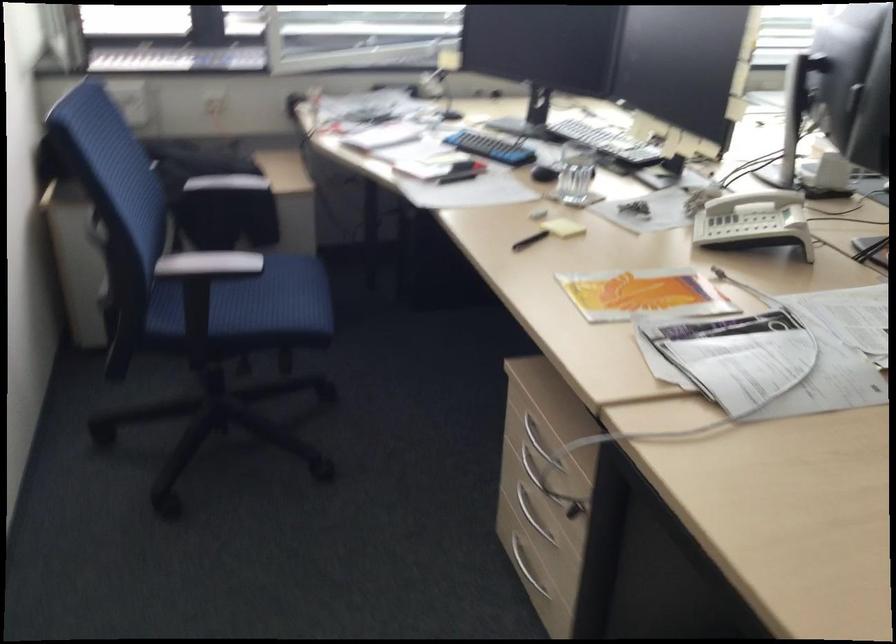
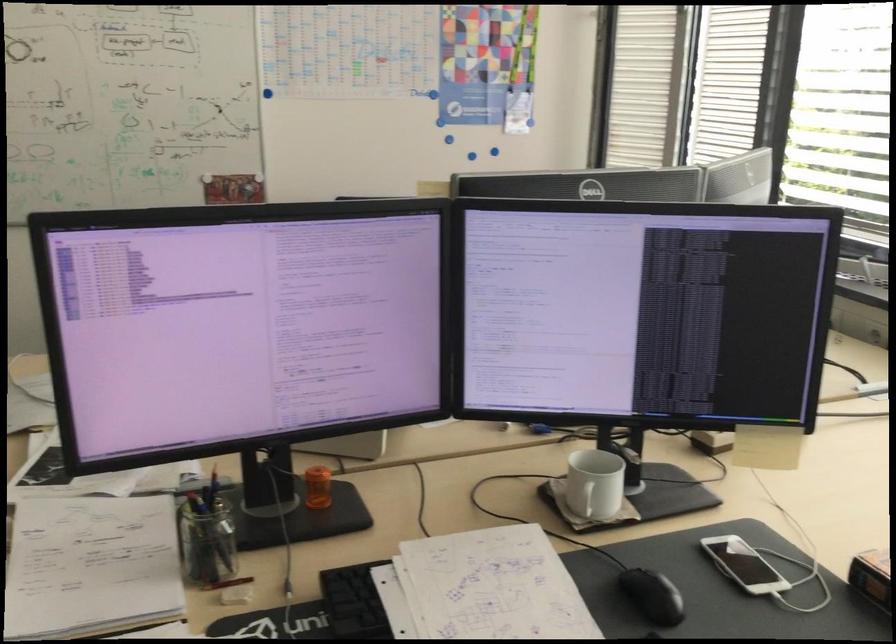
Question: I am providing you with two images of the same scene from different viewpoints. After the viewpoint changes to image2, which objects are now occluded?

Choices:
 (A) white mug handle
 (B) telephone button
 (C) glass pencil holder
 (D) long refrigerator handle

Answer: (B)